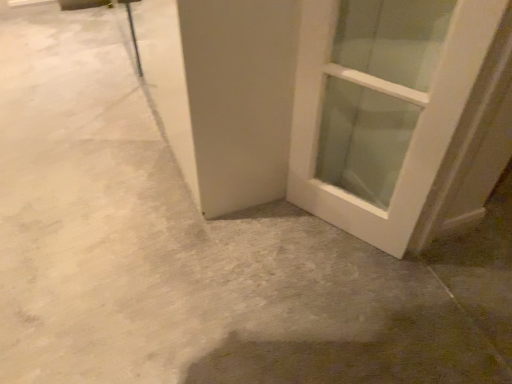
The height and width of the screenshot is (384, 512). Find the location of `free space in front of white wooden door at lower right`. free space in front of white wooden door at lower right is located at coordinates (351, 285).